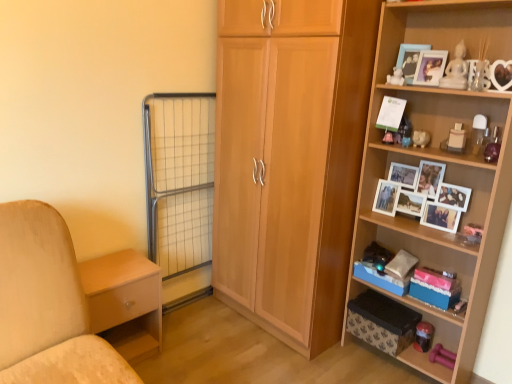
At what (x,y) coordinates should I click in order to perform the action: click on vacant point above patterned fabric storage box at lower right, marked as the 1th storage box in a bottom-to-top arrangement (from a real-world perspective). Please return your answer as a coordinate pair (x, y). Looking at the image, I should click on (384, 306).